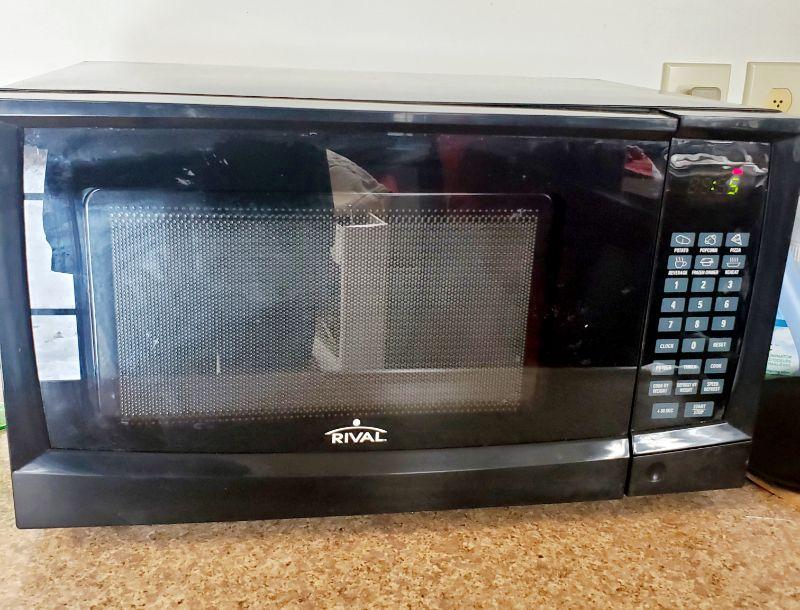
Where is `outlet`? This screenshot has width=800, height=610. outlet is located at coordinates (782, 91).